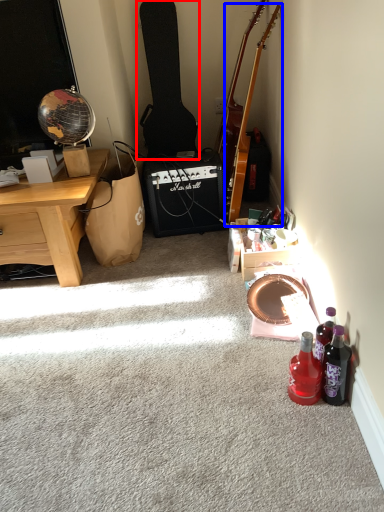
Question: Which object is further to the camera taking this photo, guitar (highlighted by a red box) or guitar (highlighted by a blue box)?

Choices:
 (A) guitar
 (B) guitar

Answer: (A)